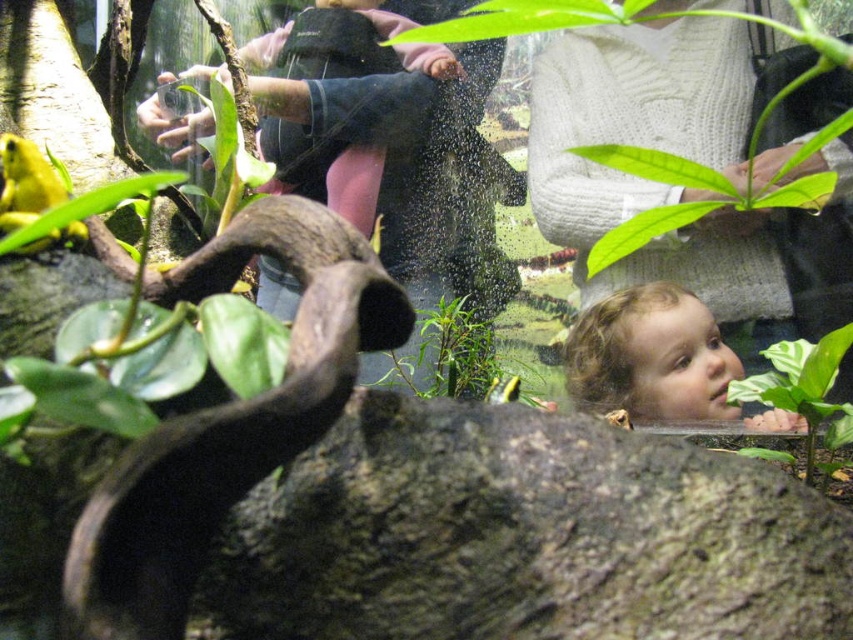
You are a parent trying to locate your child in the terrarium scene. You see the matte pink sweater at upper center and the green leafy plant at lower right. Which object is closer to you?

The matte pink sweater at upper center is closer to you because the green leafy plant at lower right is behind it.

You are a parent trying to locate your child in the terrarium scene. You see the matte pink sweater at upper center and the green leafy plant at lower right. Which object is higher in the image?

The matte pink sweater at upper center is taller than the green leafy plant at lower right, so the matte pink sweater at upper center is higher in the image.

You are standing at the point with coordinates point (769, 429) and want to see the point point (328, 106). Is there any obstruction between them?

Yes, because point (328, 106) is behind point (769, 429), so the point (769, 429) obstructs the view between them.